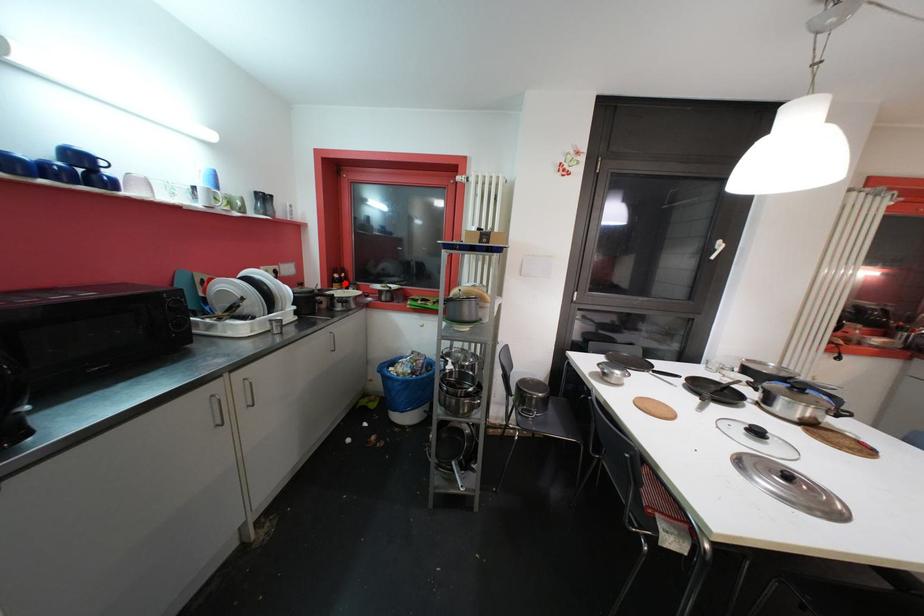
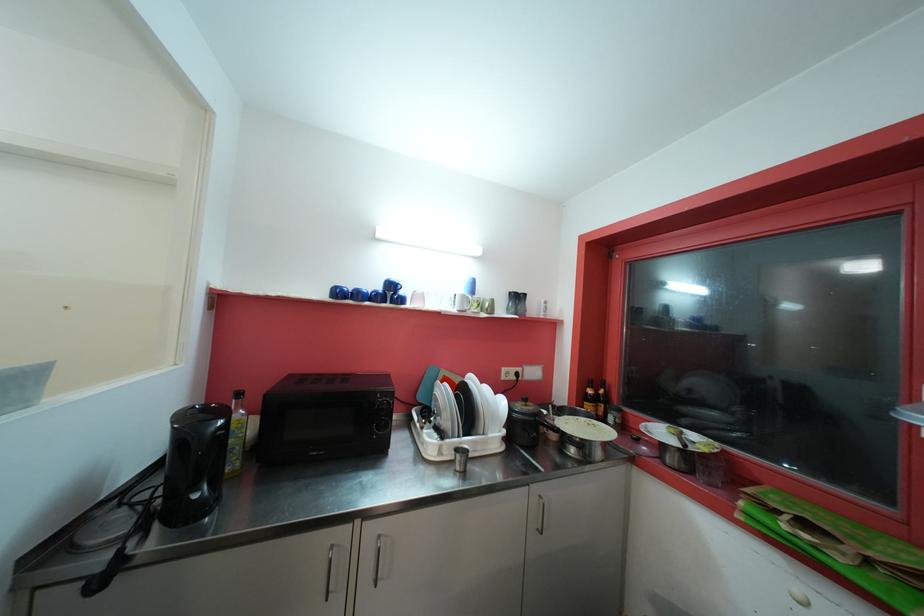
Find the pixel in the second image that matches the highlighted location in the first image.

(601, 402)